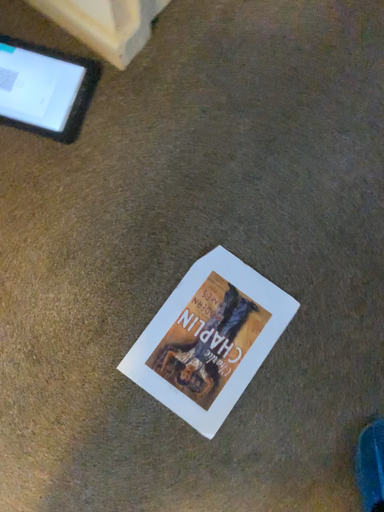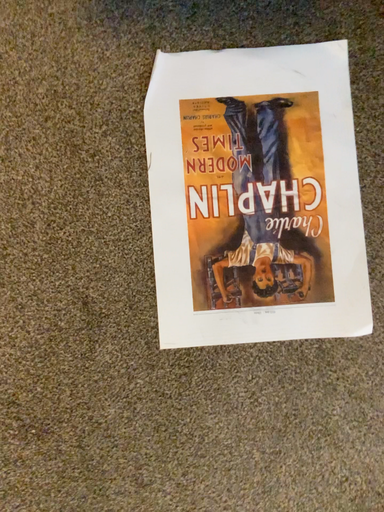
Question: Which way did the camera rotate in the video?

Choices:
 (A) rotated right
 (B) rotated left

Answer: (A)